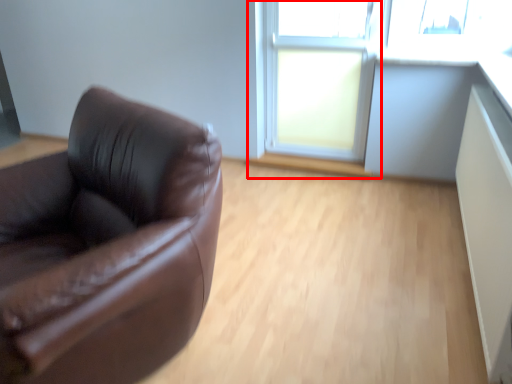
Question: From the image's perspective, where is window frame (annotated by the red box) located relative to window?

Choices:
 (A) above
 (B) below

Answer: (A)